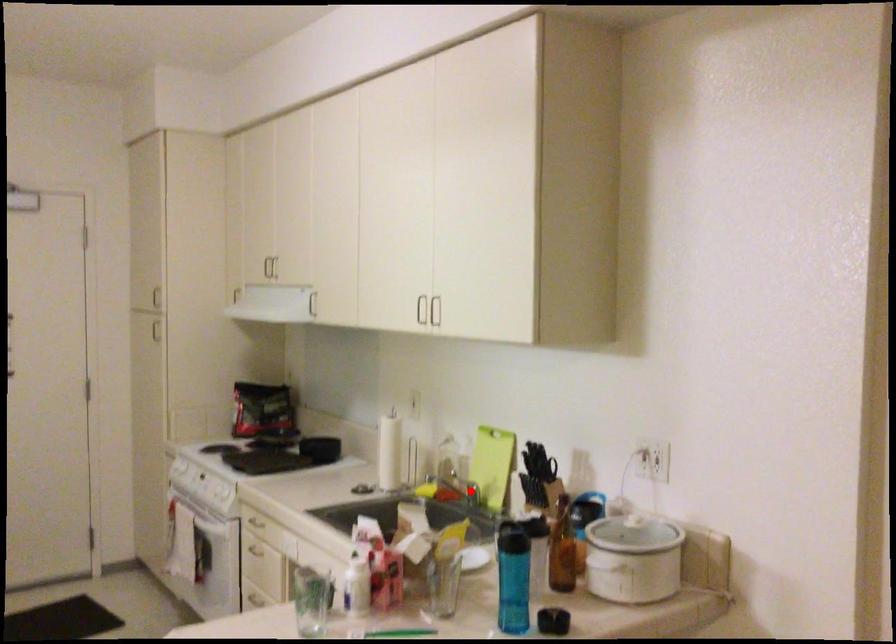
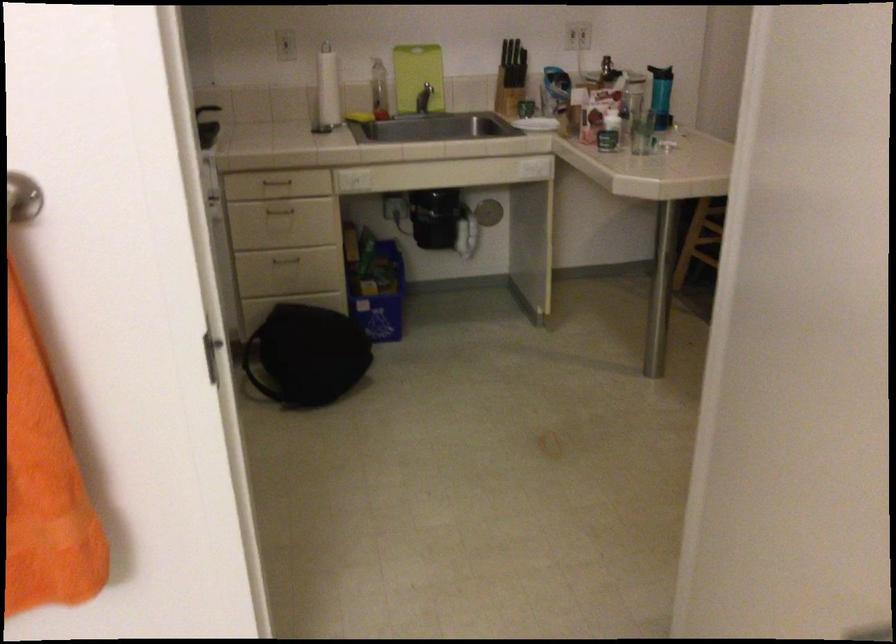
Question: A red point is marked in image1. In image2, is the corresponding 3D point closer to the camera or farther? Reply with the corresponding letter.

Choices:
 (A) The corresponding 3D point is closer.
 (B) The corresponding 3D point is farther.

Answer: (B)